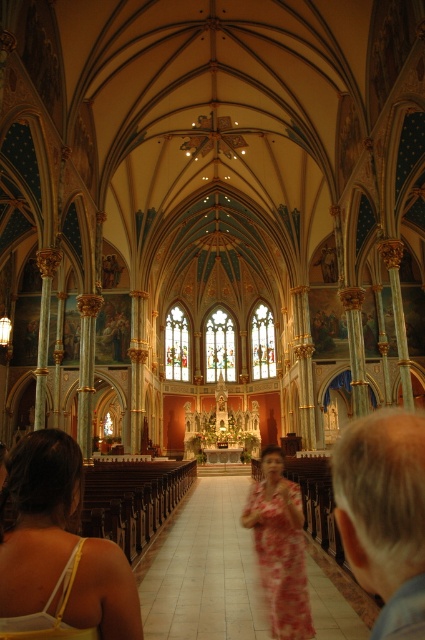
Who is shorter, gray hair at right or yellow floral dress at lower left?

With less height is yellow floral dress at lower left.

Is point (388, 428) closer to viewer compared to point (11, 634)?

No.

Locate an element on the screen. gray hair at right is located at coordinates (384, 513).

Is matte yellow tank top at lower left wider than gray hair at right?

Indeed, matte yellow tank top at lower left has a greater width compared to gray hair at right.

Between matte yellow tank top at lower left and gray hair at right, which one is positioned higher?

matte yellow tank top at lower left

The height and width of the screenshot is (640, 425). I want to click on matte yellow tank top at lower left, so click(57, 554).

Is gray hair at right to the left of floral print fabric dress at center from the viewer's perspective?

Incorrect, gray hair at right is not on the left side of floral print fabric dress at center.

Which of these two, gray hair at right or floral print fabric dress at center, stands shorter?

floral print fabric dress at center

Find the location of a particular element. The image size is (425, 640). gray hair at right is located at coordinates (384, 513).